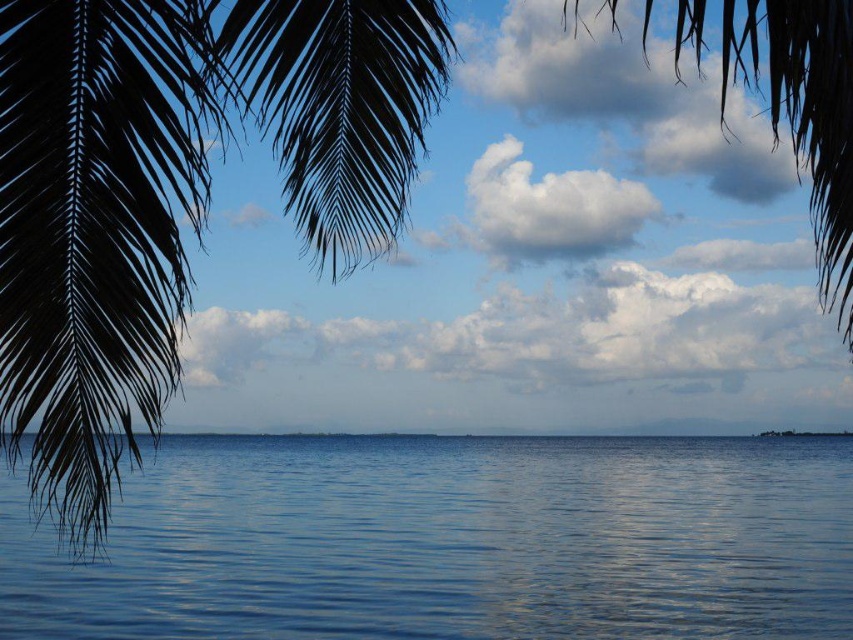
Question: Which of the following is the farthest from the observer?

Choices:
 (A) click(730, 528)
 (B) click(810, 176)
 (C) click(165, 74)

Answer: (A)

Question: Which point is farther to the camera?

Choices:
 (A) dark green leafy palm tree at left
 (B) silky brown leaf at upper center
 (C) glossy blue water at center

Answer: (C)

Question: Which point is farther to the camera?

Choices:
 (A) dark green leafy palm tree at left
 (B) silky brown leaf at upper center
 (C) glossy blue water at center

Answer: (C)

Question: Is glossy blue water at center positioned in front of silky brown leaf at upper center?

Choices:
 (A) yes
 (B) no

Answer: (B)

Question: In this image, where is glossy blue water at center located relative to dark green leafy palm tree at left?

Choices:
 (A) above
 (B) below

Answer: (B)

Question: Can you confirm if glossy blue water at center is smaller than silky brown leaf at upper center?

Choices:
 (A) no
 (B) yes

Answer: (B)